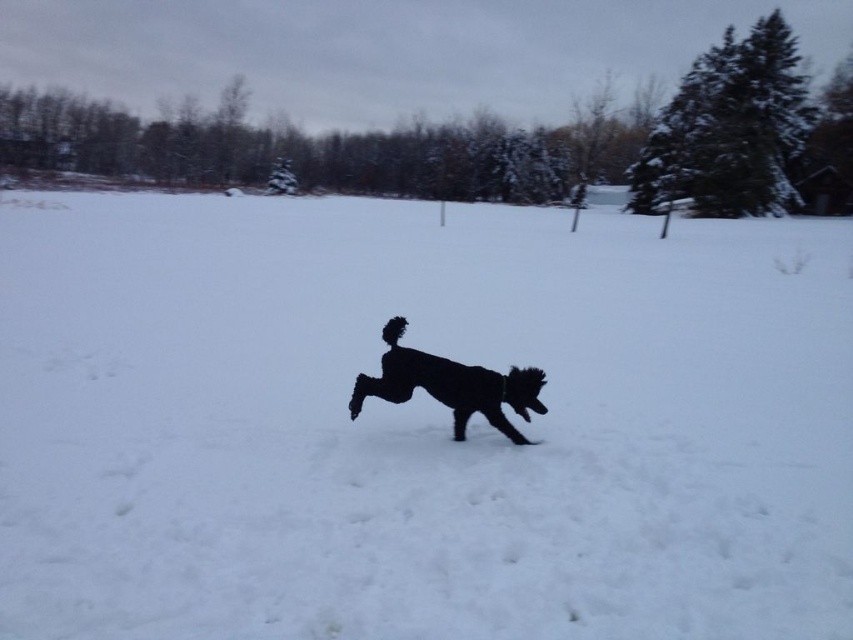
You are standing in the snowy landscape and see the white fluffy snow at center and the black fluffy dog at center. Which object is located to the right of the other?

The white fluffy snow at center is to the right of the black fluffy dog at center.

You are a photographer trying to capture the black fluffy dog at center in the snow. Based on the scene, where should you position your camera to ensure the dog is clearly visible against the white fluffy snow at center?

Position your camera so that the black fluffy dog at center is below the white fluffy snow at center, as the white fluffy snow at center is above the black fluffy dog at center, creating contrast for visibility.